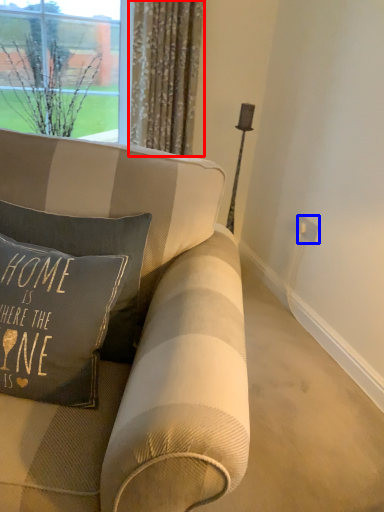
Question: Which of the following is the closest to the observer, curtain (highlighted by a red box) or electric outlet (highlighted by a blue box)?

Choices:
 (A) curtain
 (B) electric outlet

Answer: (A)